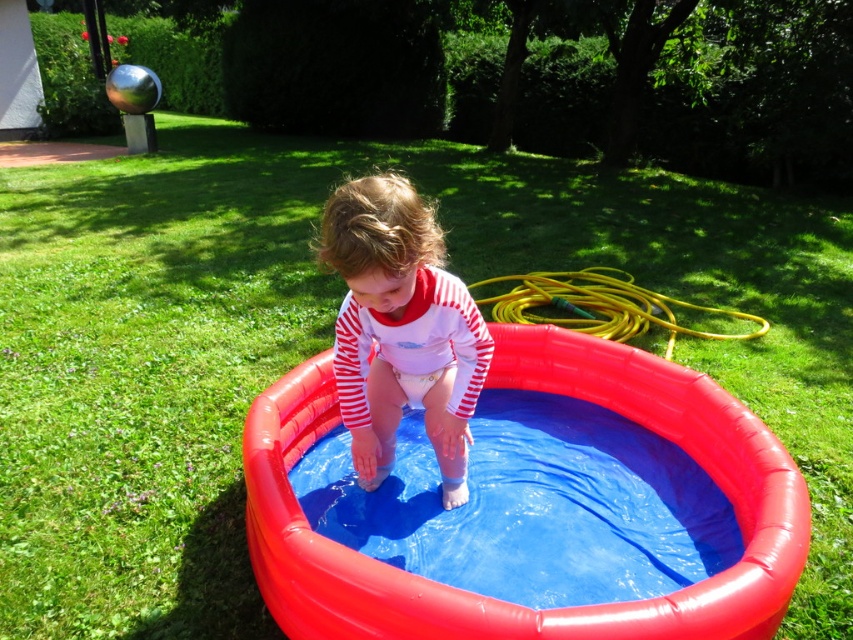
Is point (759, 582) closer to camera compared to point (343, 221)?

No, (759, 582) is behind (343, 221).

Does rubber inflatable pool at center have a greater width compared to white striped shirt at center?

Correct, the width of rubber inflatable pool at center exceeds that of white striped shirt at center.

Where is `rubber inflatable pool at center`? rubber inflatable pool at center is located at coordinates [x=498, y=600].

Where is `rubber inflatable pool at center`? This screenshot has width=853, height=640. rubber inflatable pool at center is located at coordinates (498, 600).

Is point (386, 221) positioned after point (595, 276)?

No.

Who is more distant from viewer, (350, 291) or (732, 316)?

The point (732, 316) is behind.

Is point (465, 397) closer to viewer compared to point (521, 282)?

Yes, it is.

Find the location of a particular element. This screenshot has height=640, width=853. white striped shirt at center is located at coordinates 399,328.

Is rubber inflatable pool at center above yellow rubber hose at upper right?

Actually, rubber inflatable pool at center is below yellow rubber hose at upper right.

Who is taller, rubber inflatable pool at center or yellow rubber hose at upper right?

Standing taller between the two is rubber inflatable pool at center.

You are a GUI agent. You are given a task and a screenshot of the screen. Output one action in this format:
    pyautogui.click(x=<x>, y=<y>)
    Task: Click on the rubber inflatable pool at center
    The width and height of the screenshot is (853, 640).
    Given the screenshot: What is the action you would take?
    pyautogui.click(x=498, y=600)